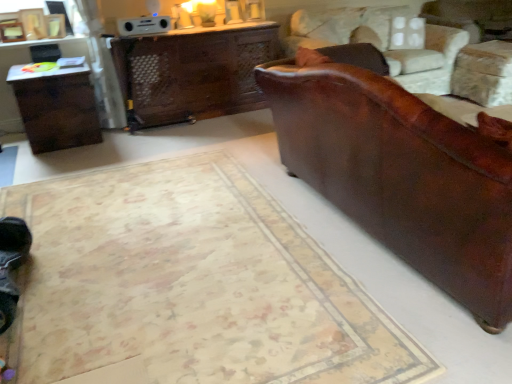
Question: Is dark brown wood table at left bigger or smaller than brown leather swivel chair at right?

Choices:
 (A) big
 (B) small

Answer: (B)

Question: Considering the relative positions of dark brown wood table at left and brown leather swivel chair at right in the image provided, is dark brown wood table at left to the left or to the right of brown leather swivel chair at right?

Choices:
 (A) left
 (B) right

Answer: (A)

Question: Which object is positioned closest to the leather couch at right?

Choices:
 (A) beige carpet at lower right
 (B) brown leather swivel chair at right
 (C) dark brown wood table at left
 (D) wooden desk at center

Answer: (A)

Question: Which of these objects is positioned closest to the beige carpet at lower right?

Choices:
 (A) dark brown wood table at left
 (B) leather couch at right
 (C) brown leather swivel chair at right
 (D) wooden desk at center

Answer: (B)